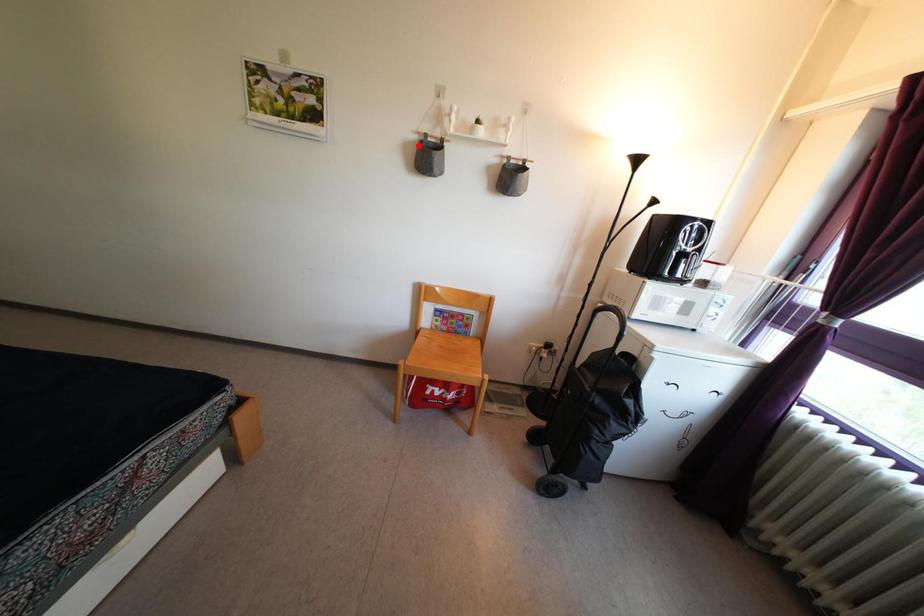
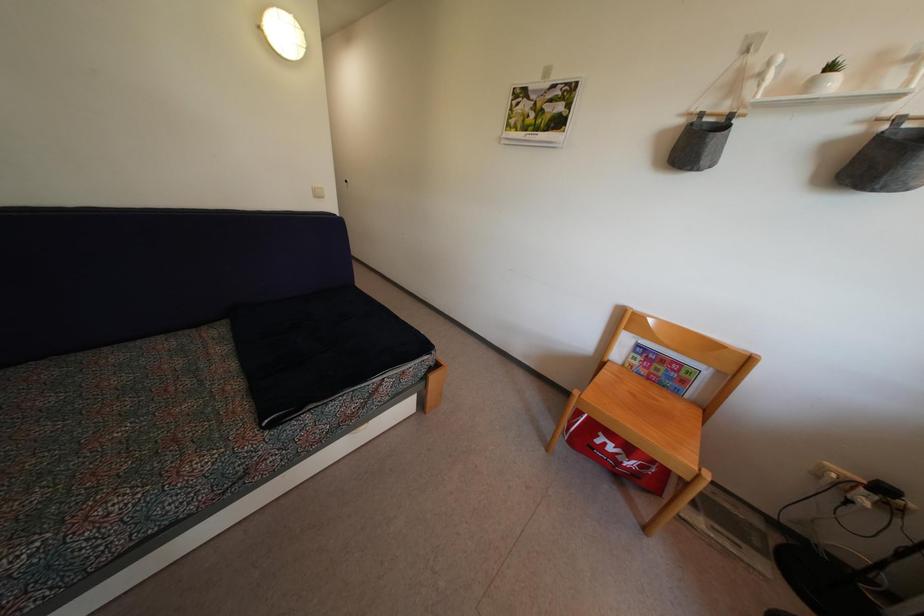
Question: I am providing you with two images of the same scene from different viewpoints. In image1, a red point is highlighted. Considering the same 3D point in image2, which of the following is correct?

Choices:
 (A) It is closer
 (B) It is farther

Answer: (B)